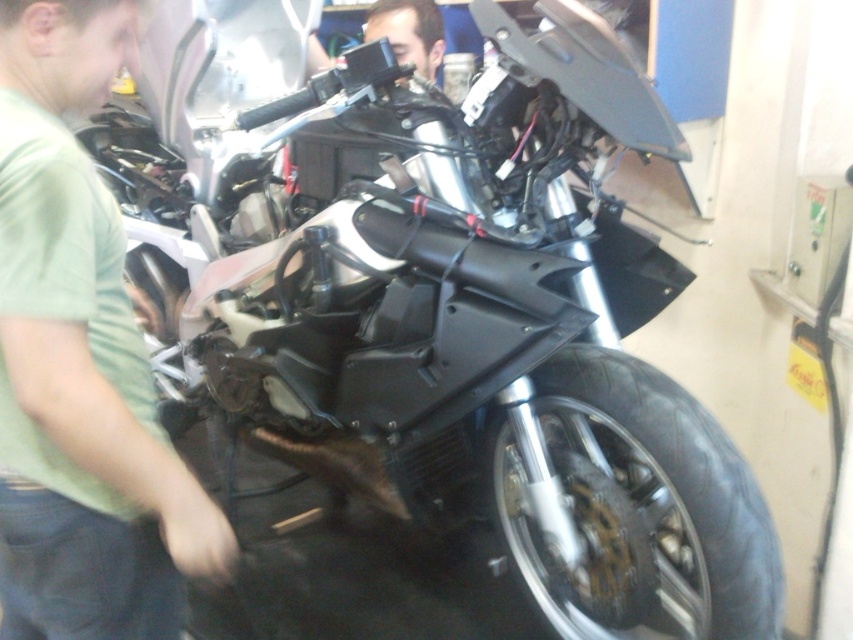
Who is positioned more to the right, green matte shirt at left or matte black camera at upper center?

Positioned to the right is matte black camera at upper center.

Is green matte shirt at left taller than matte black camera at upper center?

Yes.

The image size is (853, 640). I want to click on green matte shirt at left, so click(80, 362).

Where is `green matte shirt at left`? This screenshot has width=853, height=640. green matte shirt at left is located at coordinates (80, 362).

Can you confirm if black rubber tire at lower right is positioned to the left of matte black camera at upper center?

Incorrect, black rubber tire at lower right is not on the left side of matte black camera at upper center.

Can you confirm if black rubber tire at lower right is smaller than matte black camera at upper center?

Actually, black rubber tire at lower right might be larger than matte black camera at upper center.

Is point (775, 595) positioned before point (379, 20)?

Yes.

The height and width of the screenshot is (640, 853). I want to click on black rubber tire at lower right, so click(x=636, y=509).

Is green matte shirt at left thinner than black rubber tire at lower right?

Correct, green matte shirt at left's width is less than black rubber tire at lower right's.

Is green matte shirt at left wider than black rubber tire at lower right?

In fact, green matte shirt at left might be narrower than black rubber tire at lower right.

Is point (88, 419) closer to camera compared to point (634, 412)?

Yes, point (88, 419) is in front of point (634, 412).

Locate an element on the screen. This screenshot has height=640, width=853. green matte shirt at left is located at coordinates (80, 362).